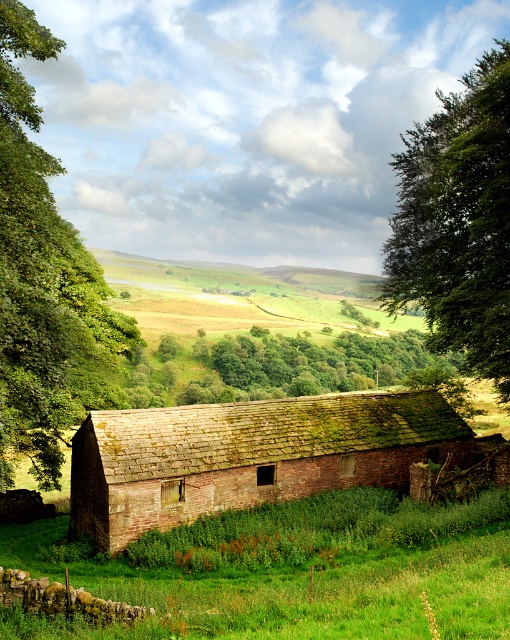
You are a gardener planning to plant a row of flowers between the green grassy at lower center and the brown brick barn at center. Considering their sizes, which area should you choose to ensure the flowers have enough space to grow without overcrowding?

The green grassy at lower center is bigger than the brown brick barn at center, so planting the flowers there would provide more space for growth without overcrowding.